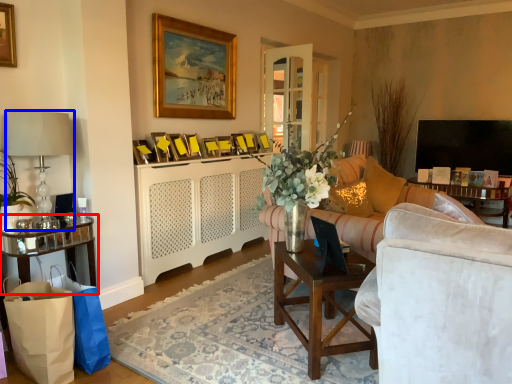
Question: Which point is further to the camera, table (highlighted by a red box) or lamp (highlighted by a blue box)?

Choices:
 (A) table
 (B) lamp

Answer: (A)